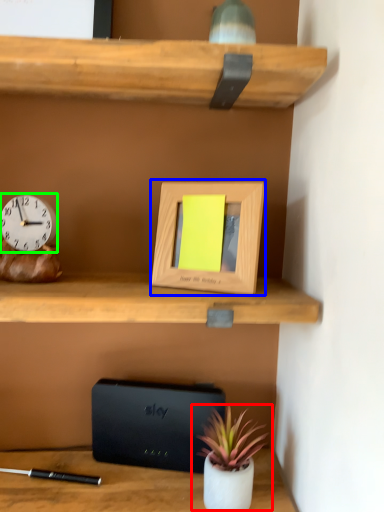
Question: Which object is positioned farthest from houseplant (highlighted by a red box)? Select from picture frame (highlighted by a blue box) and clock (highlighted by a green box).

Choices:
 (A) picture frame
 (B) clock

Answer: (B)